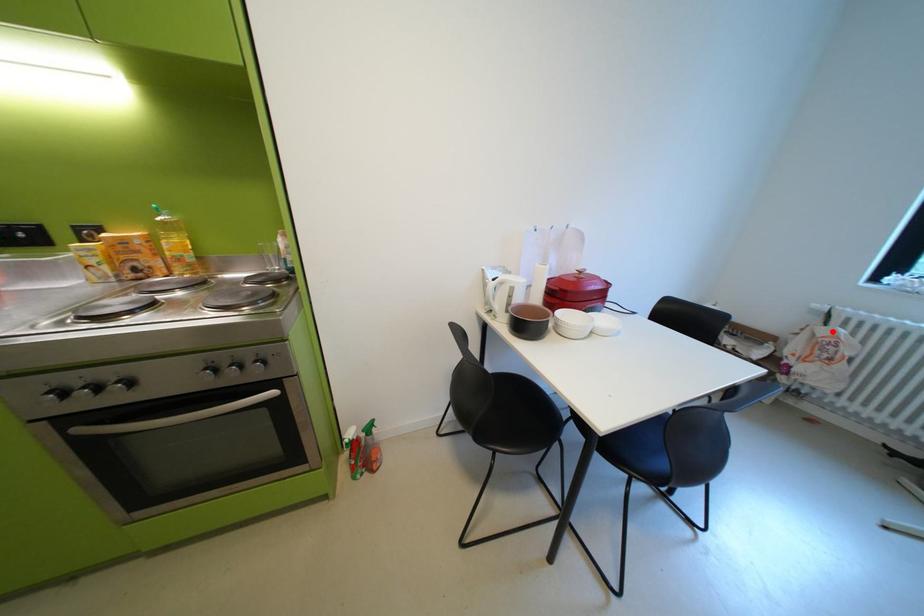
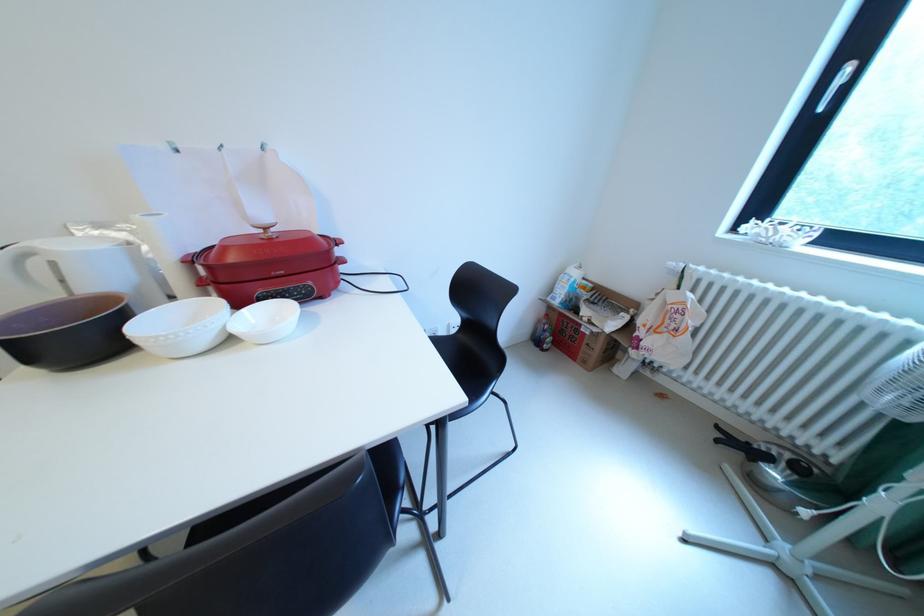
Question: I am providing you with two images of the same scene from different viewpoints. In image1, a red point is highlighted. Considering the same 3D point in image2, which of the following is correct?

Choices:
 (A) It is closer
 (B) It is farther

Answer: (A)